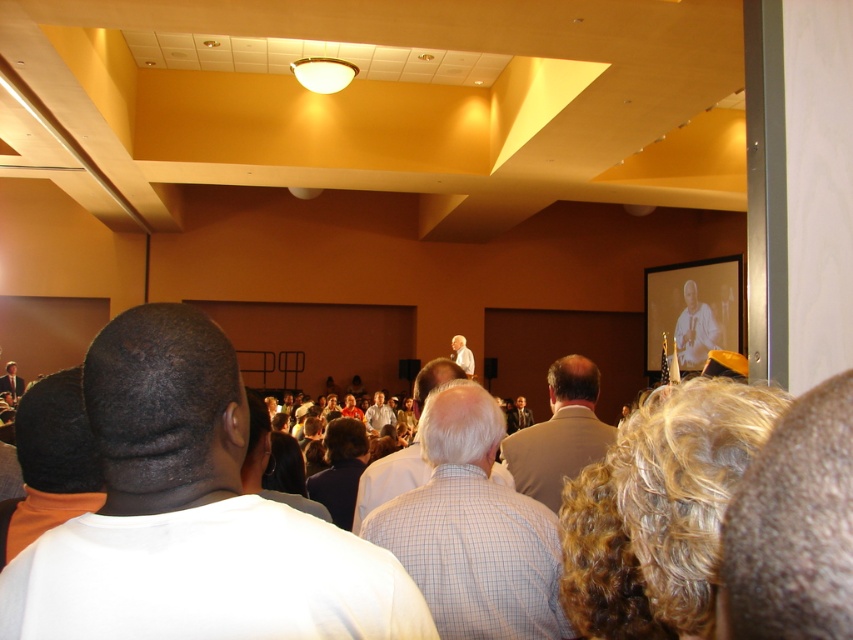
Question: Can you confirm if light blue checkered shirt at center is wider than light brown leather jacket at center?

Choices:
 (A) yes
 (B) no

Answer: (B)

Question: Among these objects, which one is farthest from the camera?

Choices:
 (A) dark brown hair at center
 (B) light brown shirt at center
 (C) smooth beige suit at center
 (D) white checkered shirt at center

Answer: (C)

Question: Is white shirt at center further to camera compared to light brown leather jacket at center?

Choices:
 (A) no
 (B) yes

Answer: (A)

Question: In this image, where is dark brown hair at center located relative to light brown shirt at center?

Choices:
 (A) left
 (B) right

Answer: (B)

Question: Based on their relative distances, which object is nearer to the light brown suit at center?

Choices:
 (A) dark brown hair at center
 (B) matte black suit at center
 (C) light blue checkered shirt at center
 (D) light brown shirt at center

Answer: (C)

Question: Estimate the real-world distances between objects in this image. Which object is closer to the light blue checkered shirt at center?

Choices:
 (A) white shirt at center
 (B) dark brown hair at center
 (C) matte black suit at center
 (D) light brown shirt at center

Answer: (A)